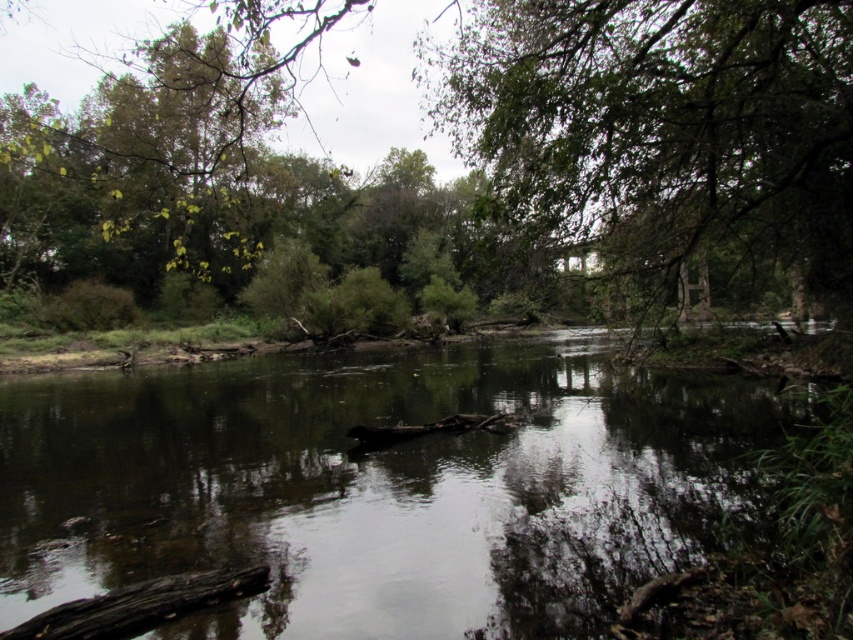
Is point (195, 630) closer to viewer compared to point (119, 602)?

Yes.

Does point (250, 387) lie behind point (199, 577)?

Yes.

You are a GUI agent. You are given a task and a screenshot of the screen. Output one action in this format:
    pyautogui.click(x=<x>, y=<y>)
    Task: Click on the smooth reflective water at center
    The height and width of the screenshot is (640, 853).
    Given the screenshot: What is the action you would take?
    pyautogui.click(x=376, y=486)

From the picture: Who is higher up, green leafy tree at upper center or dark brown wood log at lower left?

green leafy tree at upper center is higher up.

Who is more distant from viewer, (817, 141) or (105, 600)?

Positioned behind is point (817, 141).

Locate an element on the screen. This screenshot has height=640, width=853. green leafy tree at upper center is located at coordinates (659, 122).

Who is higher up, smooth reflective water at center or green leafy tree at upper center?

Positioned higher is green leafy tree at upper center.

Which of these two, smooth reflective water at center or green leafy tree at upper center, stands shorter?

smooth reflective water at center

Is point (415, 564) positioned after point (728, 230)?

No, it is in front of (728, 230).

Where is `smooth reflective water at center`? Image resolution: width=853 pixels, height=640 pixels. smooth reflective water at center is located at coordinates (376, 486).